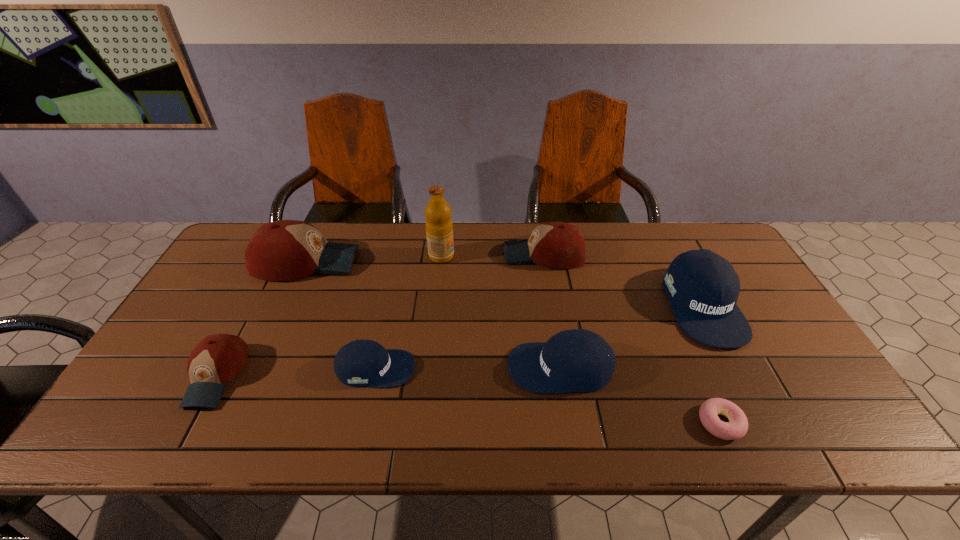
In order to click on vacant area that lies between the doughnut and the leftmost blue baseball cap in this screenshot , I will do `click(548, 396)`.

Locate an element on the screen. Image resolution: width=960 pixels, height=540 pixels. object that stands as the fourth closest to the biggest red baseball cap is located at coordinates (559, 245).

Locate which object ranks seventh in proximity to the second biggest blue baseball cap. Please provide its 2D coordinates. Your answer should be formatted as a tuple, i.e. [(x, y)], where the tuple contains the x and y coordinates of a point satisfying the conditions above.

[(217, 359)]

Where is `baseball cap that stands as the third closest to the fruit juice`? Image resolution: width=960 pixels, height=540 pixels. baseball cap that stands as the third closest to the fruit juice is located at coordinates (360, 363).

Select which baseball cap appears as the fourth closest to the rightmost baseball cap. Please provide its 2D coordinates. Your answer should be formatted as a tuple, i.e. [(x, y)], where the tuple contains the x and y coordinates of a point satisfying the conditions above.

[(285, 250)]

Where is `red baseball cap object that ranks as the closest to the rightmost baseball cap`? This screenshot has width=960, height=540. red baseball cap object that ranks as the closest to the rightmost baseball cap is located at coordinates (559, 245).

This screenshot has width=960, height=540. I want to click on the second closest red baseball cap to the rightmost red baseball cap, so click(x=217, y=359).

Choose which blue baseball cap is the second nearest neighbor to the leftmost blue baseball cap. Please provide its 2D coordinates. Your answer should be formatted as a tuple, i.e. [(x, y)], where the tuple contains the x and y coordinates of a point satisfying the conditions above.

[(703, 287)]

The image size is (960, 540). Find the location of `blue baseball cap that stands as the second closest to the fruit juice`. blue baseball cap that stands as the second closest to the fruit juice is located at coordinates (577, 360).

This screenshot has height=540, width=960. Find the location of `free space that satisfies the following two spatial constraints: 1. on the front-facing side of the fourth baseball cap from right to left; 2. on the left side of the pink doughnut`. free space that satisfies the following two spatial constraints: 1. on the front-facing side of the fourth baseball cap from right to left; 2. on the left side of the pink doughnut is located at coordinates (364, 423).